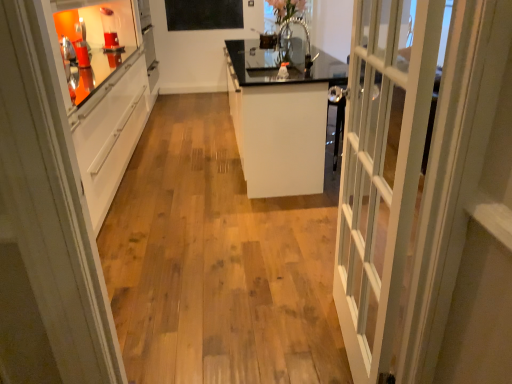
Question: In terms of height, does white glossy cabinet at center look taller or shorter compared to clear glass vase at upper center?

Choices:
 (A) short
 (B) tall

Answer: (B)

Question: In the image, is white glossy cabinet at center positioned in front of or behind clear glass vase at upper center?

Choices:
 (A) behind
 (B) front

Answer: (B)

Question: Which is nearer to the black matte bulletin board at upper center?

Choices:
 (A) white glossy cabinet at center
 (B) white glossy cabinet at left
 (C) clear glass vase at upper center

Answer: (A)

Question: Which of these objects is positioned farthest from the white glossy cabinet at center?

Choices:
 (A) clear glass vase at upper center
 (B) black matte bulletin board at upper center
 (C) white glossy cabinet at left

Answer: (B)